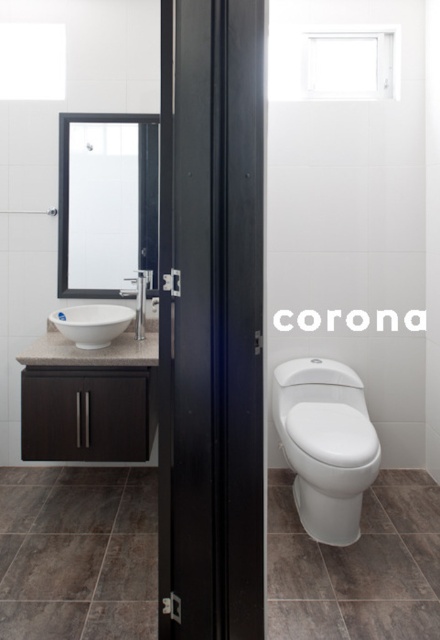
You are standing in the bathroom and want to move from the vanity unit to the toilet. You notice two points marked on the floor at coordinates point (365, 426) and point (88, 310). Which point is closer to you as you face the bathroom door?

Point (365, 426) is closer to the viewer than point (88, 310).

You are standing in the bathroom and want to place a small plant between the two points, point [138,342] and point [341,461]. Which point should you place the plant closer to so it appears closer to you?

You should place the plant closer to point [138,342] because it is closer to the viewer than point [341,461].